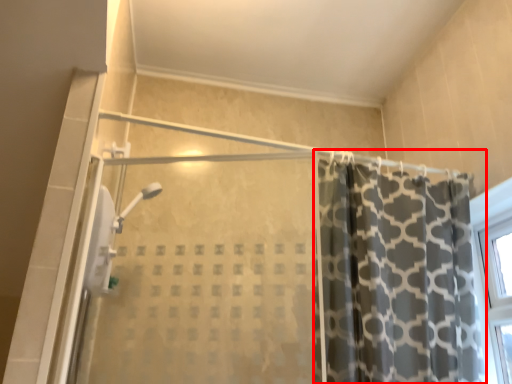
Question: From the image's perspective, what is the correct spatial relationship of curtain (annotated by the red box) in relation to screen door?

Choices:
 (A) below
 (B) above

Answer: (A)